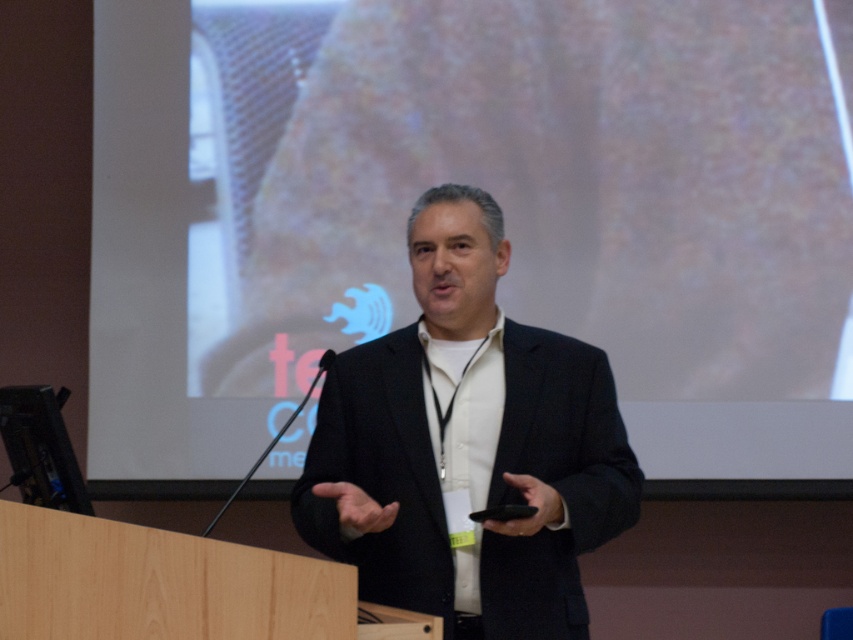
Does white matte projection screen at upper center appear over black matte suit at center?

Indeed, white matte projection screen at upper center is positioned over black matte suit at center.

Does white matte projection screen at upper center have a larger size compared to black matte suit at center?

Yes.

Identify the location of white matte projection screen at upper center. Image resolution: width=853 pixels, height=640 pixels. (492, 195).